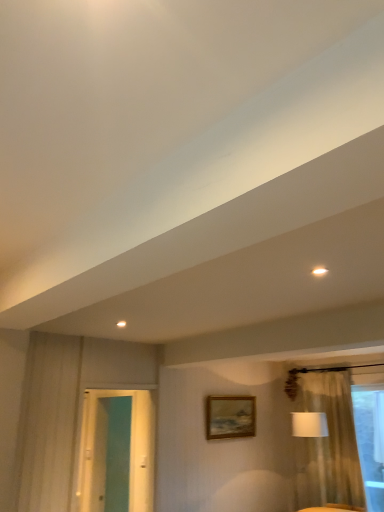
The width and height of the screenshot is (384, 512). I want to click on wooden oil painting at center, so 230,417.

What do you see at coordinates (230, 417) in the screenshot? I see `wooden oil painting at center` at bounding box center [230, 417].

I want to click on beige textured curtain at right, so click(x=328, y=444).

Locate an element on the screen. The image size is (384, 512). teal glossy door at left is located at coordinates (106, 447).

Between wooden oil painting at center and white fabric lampshade at right, which one has more height?

With more height is white fabric lampshade at right.

Consider the image. Is wooden oil painting at center situated inside white fabric lampshade at right or outside?

wooden oil painting at center cannot be found inside white fabric lampshade at right.

From a real-world perspective, which object stands above the other?

From a 3D spatial view, wooden oil painting at center is above.

Which of these two, wooden oil painting at center or white fabric lampshade at right, is thinner?

With smaller width is wooden oil painting at center.

From a real-world perspective, is wooden oil painting at center physically below beige textured curtain at right?

No, from a real-world perspective, wooden oil painting at center is not under beige textured curtain at right.

Can you confirm if wooden oil painting at center is thinner than beige textured curtain at right?

In fact, wooden oil painting at center might be wider than beige textured curtain at right.

From the picture: Can you tell me how much wooden oil painting at center and beige textured curtain at right differ in facing direction?

The angular difference between wooden oil painting at center and beige textured curtain at right is 90.7 degrees.

Identify the location of curtain that appears below the white fabric lampshade at right (from the image's perspective). (328, 444).

From the image's perspective, which is above, beige textured curtain at right or white fabric lampshade at right?

From the image's view, white fabric lampshade at right is above.

Which of these two, beige textured curtain at right or white fabric lampshade at right, is bigger?

white fabric lampshade at right is bigger.

Is beige textured curtain at right shorter than white fabric lampshade at right?

No, beige textured curtain at right is not shorter than white fabric lampshade at right.

Where is `picture frame that appears on the right of teal glossy door at left`? This screenshot has width=384, height=512. picture frame that appears on the right of teal glossy door at left is located at coordinates (230, 417).

Based on their positions, is wooden oil painting at center located to the left or right of teal glossy door at left?

From the image, it's evident that wooden oil painting at center is to the right of teal glossy door at left.

From the image's perspective, is wooden oil painting at center positioned above or below teal glossy door at left?

Based on their image positions, wooden oil painting at center is located beneath teal glossy door at left.

In the image, there is a teal glossy door at left. Where is `curtain below it (from a real-world perspective)`? This screenshot has height=512, width=384. curtain below it (from a real-world perspective) is located at coordinates tap(328, 444).

Is teal glossy door at left surrounding beige textured curtain at right?

No, beige textured curtain at right is located outside of teal glossy door at left.

How many degrees apart are the facing directions of teal glossy door at left and beige textured curtain at right?

The angular difference between teal glossy door at left and beige textured curtain at right is 90.9 degrees.

Which object is thinner, teal glossy door at left or beige textured curtain at right?

With smaller width is beige textured curtain at right.

Which is less distant, (331, 444) or (222, 418)?

The point (222, 418) is closer.

Considering the sizes of objects beige textured curtain at right and wooden oil painting at center in the image provided, who is bigger, beige textured curtain at right or wooden oil painting at center?

wooden oil painting at center is bigger.

Which is behind, beige textured curtain at right or wooden oil painting at center?

wooden oil painting at center is further away from the camera.

Considering the sizes of white fabric lampshade at right and white glossy light fixture at upper right in the image, is white fabric lampshade at right taller or shorter than white glossy light fixture at upper right?

Considering their sizes, white fabric lampshade at right has more height than white glossy light fixture at upper right.

What's the angular difference between white fabric lampshade at right and white glossy light fixture at upper right's facing directions?

white fabric lampshade at right and white glossy light fixture at upper right are facing 87.9 degrees away from each other.

Where is `table lamp lying behind the white glossy light fixture at upper right`? table lamp lying behind the white glossy light fixture at upper right is located at coordinates (309, 424).

In the scene shown: Looking at the image, does white fabric lampshade at right seem bigger or smaller compared to white glossy light fixture at upper right?

Clearly, white fabric lampshade at right is larger in size than white glossy light fixture at upper right.

Locate an element on the screen. The width and height of the screenshot is (384, 512). picture frame that is above the white fabric lampshade at right (from a real-world perspective) is located at coordinates (230, 417).

Where is `picture frame on the left of beige textured curtain at right`? The width and height of the screenshot is (384, 512). picture frame on the left of beige textured curtain at right is located at coordinates (230, 417).

Based on their spatial positions, is white fabric lampshade at right or wooden oil painting at center closer to beige textured curtain at right?

white fabric lampshade at right.

Based on their spatial positions, is white glossy light fixture at upper right or white fabric lampshade at right further from wooden oil painting at center?

white glossy light fixture at upper right lies further to wooden oil painting at center than the other object.

Which object lies nearer to the anchor point wooden oil painting at center, teal glossy door at left or white fabric lampshade at right?

white fabric lampshade at right is positioned closer to the anchor wooden oil painting at center.

Estimate the real-world distances between objects in this image. Which object is further from beige textured curtain at right, wooden oil painting at center or white fabric lampshade at right?

Based on the image, wooden oil painting at center appears to be further to beige textured curtain at right.

Considering their positions, is wooden oil painting at center positioned closer to white glossy light fixture at upper right than beige textured curtain at right?

wooden oil painting at center.

Looking at the image, which one is located closer to teal glossy door at left, wooden oil painting at center or beige textured curtain at right?

The object closer to teal glossy door at left is wooden oil painting at center.

Looking at the image, which one is located further to teal glossy door at left, white glossy light fixture at upper right or white fabric lampshade at right?

white glossy light fixture at upper right.

Which object lies further to the anchor point teal glossy door at left, beige textured curtain at right or wooden oil painting at center?

Among the two, beige textured curtain at right is located further to teal glossy door at left.

This screenshot has height=512, width=384. Find the location of `picture frame located between teal glossy door at left and white fabric lampshade at right in the left-right direction`. picture frame located between teal glossy door at left and white fabric lampshade at right in the left-right direction is located at coordinates (230, 417).

At what (x,y) coordinates should I click in order to perform the action: click on curtain between white glossy light fixture at upper right and wooden oil painting at center along the z-axis. Please return your answer as a coordinate pair (x, y). This screenshot has height=512, width=384. Looking at the image, I should click on (328, 444).

Locate an element on the screen. lighting located between teal glossy door at left and beige textured curtain at right in the left-right direction is located at coordinates (319, 271).

Where is `table lamp between teal glossy door at left and beige textured curtain at right in the horizontal direction`? table lamp between teal glossy door at left and beige textured curtain at right in the horizontal direction is located at coordinates (309, 424).